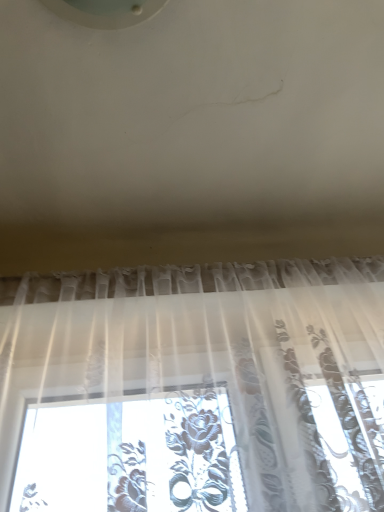
Describe the element at coordinates (195, 389) in the screenshot. I see `sheer white curtain at bottom` at that location.

Where is `sheer white curtain at bottom`? This screenshot has height=512, width=384. sheer white curtain at bottom is located at coordinates (195, 389).

What are the coordinates of `sheer white curtain at bottom` in the screenshot? It's located at (195, 389).